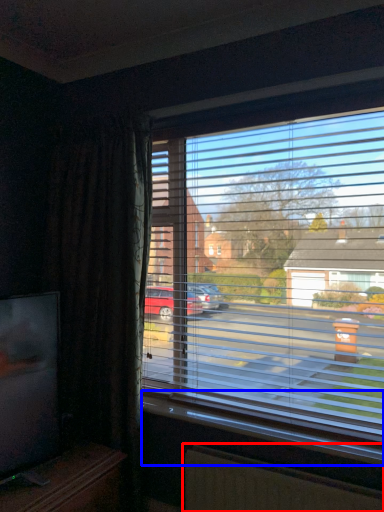
Question: Which object appears farthest to the camera in this image, radiator (highlighted by a red box) or window sill (highlighted by a blue box)?

Choices:
 (A) radiator
 (B) window sill

Answer: (B)